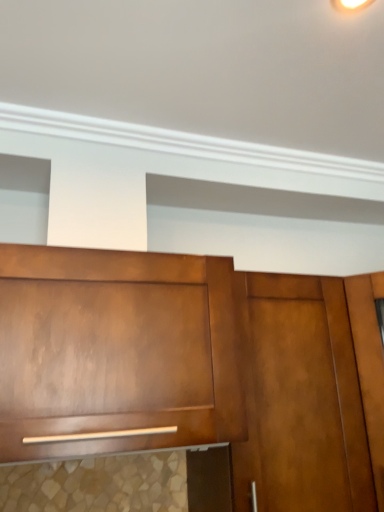
Describe the element at coordinates (186, 368) in the screenshot. The height and width of the screenshot is (512, 384). I see `matte wood cabinet at center` at that location.

Where is `matte wood cabinet at center`? This screenshot has height=512, width=384. matte wood cabinet at center is located at coordinates (186, 368).

Identify the location of satin wood door at center. The height and width of the screenshot is (512, 384). (300, 399).

What is the approximate height of satin wood door at center?

The height of satin wood door at center is 25.72 inches.

Describe the element at coordinates (300, 399) in the screenshot. Image resolution: width=384 pixels, height=512 pixels. I see `satin wood door at center` at that location.

At what (x,y) coordinates should I click in order to perform the action: click on matte wood cabinet at center. Please return your answer as a coordinate pair (x, y). This screenshot has height=512, width=384. Looking at the image, I should click on pyautogui.click(x=186, y=368).

Considering the positions of objects satin wood door at center and matte wood cabinet at center in the image provided, who is more to the right, satin wood door at center or matte wood cabinet at center?

satin wood door at center is more to the right.

Considering their positions, is satin wood door at center located in front of or behind matte wood cabinet at center?

Clearly, satin wood door at center is behind matte wood cabinet at center.

Considering the positions of point (263, 421) and point (266, 494), is point (263, 421) closer or farther from the camera than point (266, 494)?

Point (263, 421).

From the image's perspective, which object appears higher, satin wood door at center or matte wood cabinet at center?

From the image's view, matte wood cabinet at center is above.

From a real-world perspective, between satin wood door at center and matte wood cabinet at center, who is vertically higher?

From a 3D spatial view, matte wood cabinet at center is above.

Which of these two, satin wood door at center or matte wood cabinet at center, is thinner?

With smaller width is satin wood door at center.

Looking at this image, does satin wood door at center have a lesser height compared to matte wood cabinet at center?

In fact, satin wood door at center may be taller than matte wood cabinet at center.

Considering the relative sizes of satin wood door at center and matte wood cabinet at center in the image provided, is satin wood door at center bigger than matte wood cabinet at center?

No, satin wood door at center is not bigger than matte wood cabinet at center.

Would you say satin wood door at center contains matte wood cabinet at center?

No, matte wood cabinet at center is located outside of satin wood door at center.

Is satin wood door at center far from matte wood cabinet at center?

No, satin wood door at center is in close proximity to matte wood cabinet at center.

Does satin wood door at center turn towards matte wood cabinet at center?

No, satin wood door at center is not oriented towards matte wood cabinet at center.

How many degrees apart are the facing directions of satin wood door at center and matte wood cabinet at center?

satin wood door at center and matte wood cabinet at center are facing 0.946 degrees away from each other.

Find the location of a particular element. Image resolution: width=384 pixels, height=512 pixels. door on the right of matte wood cabinet at center is located at coordinates (300, 399).

Which is more to the left, matte wood cabinet at center or satin wood door at center?

Positioned to the left is matte wood cabinet at center.

Is matte wood cabinet at center further to the viewer compared to satin wood door at center?

No, matte wood cabinet at center is closer to the viewer.

Considering the points (36, 454) and (271, 294), which point is in front, point (36, 454) or point (271, 294)?

The point (36, 454) is in front.

From the image's perspective, is matte wood cabinet at center above satin wood door at center?

Correct, matte wood cabinet at center appears higher than satin wood door at center in the image.

Looking at this image, from a real-world perspective, is matte wood cabinet at center physically located above or below satin wood door at center?

matte wood cabinet at center is situated higher than satin wood door at center in the real world.

In the scene shown: Does matte wood cabinet at center have a greater width compared to satin wood door at center?

Yes.

Is matte wood cabinet at center shorter than satin wood door at center?

Correct, matte wood cabinet at center is not as tall as satin wood door at center.

Does matte wood cabinet at center have a larger size compared to satin wood door at center?

Yes.

Would you say satin wood door at center is part of matte wood cabinet at center's contents?

That's incorrect, satin wood door at center is not inside matte wood cabinet at center.

Are matte wood cabinet at center and satin wood door at center far apart?

That's not correct — matte wood cabinet at center is a little close to satin wood door at center.

Is matte wood cabinet at center positioned with its back to satin wood door at center?

That's not correct — matte wood cabinet at center is not looking away from satin wood door at center.

How many degrees apart are the facing directions of matte wood cabinet at center and satin wood door at center?

There is a 0.946-degree angle between the facing directions of matte wood cabinet at center and satin wood door at center.

Image resolution: width=384 pixels, height=512 pixels. Identify the location of door behind the matte wood cabinet at center. (300, 399).

Locate an element on the screen. This screenshot has width=384, height=512. door below the matte wood cabinet at center (from the image's perspective) is located at coordinates (300, 399).

At what (x,y) coordinates should I click in order to perform the action: click on cabinetry in front of the satin wood door at center. Please return your answer as a coordinate pair (x, y). The height and width of the screenshot is (512, 384). Looking at the image, I should click on [186, 368].